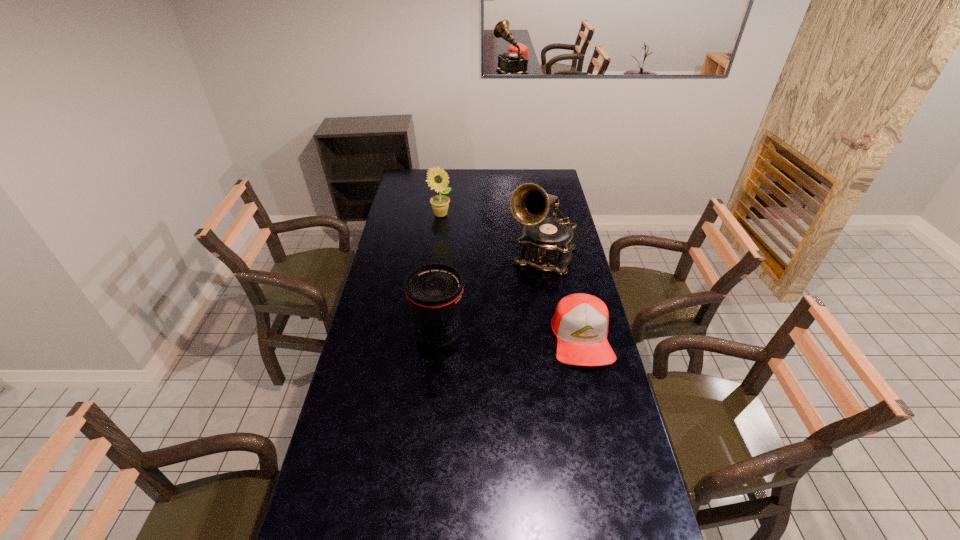
Where is `vacant space that is in between the telephoto lens and the baseball cap`? Image resolution: width=960 pixels, height=540 pixels. vacant space that is in between the telephoto lens and the baseball cap is located at coordinates (510, 337).

Locate an element on the screen. The image size is (960, 540). free space between the second farthest object and the farthest object is located at coordinates (492, 235).

Identify the location of empty space between the phonograph record and the telephoto lens. The width and height of the screenshot is (960, 540). (491, 296).

This screenshot has height=540, width=960. What are the coordinates of `vacant region between the phonograph record and the farthest object` in the screenshot? It's located at (492, 235).

Find the location of `free space that is in between the telephoto lens and the shortest object`. free space that is in between the telephoto lens and the shortest object is located at coordinates (510, 337).

Where is `free space between the phonograph record and the farthest object`? free space between the phonograph record and the farthest object is located at coordinates (492, 235).

Identify which object is the second nearest to the shortest object. Please provide its 2D coordinates. Your answer should be formatted as a tuple, i.e. [(x, y)], where the tuple contains the x and y coordinates of a point satisfying the conditions above.

[(434, 291)]

The height and width of the screenshot is (540, 960). I want to click on object that is the third closest to the telephoto lens, so click(437, 179).